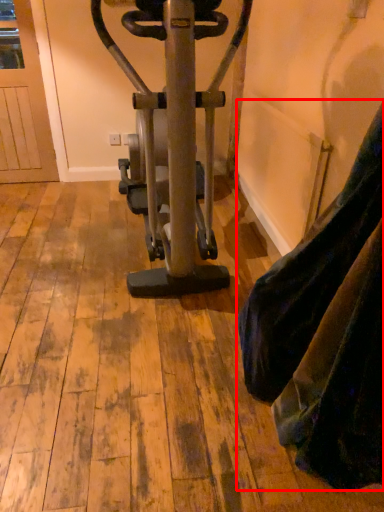
Question: Observing the image, what is the correct spatial positioning of tight (annotated by the red box) in reference to stationary bicycle?

Choices:
 (A) left
 (B) right

Answer: (B)